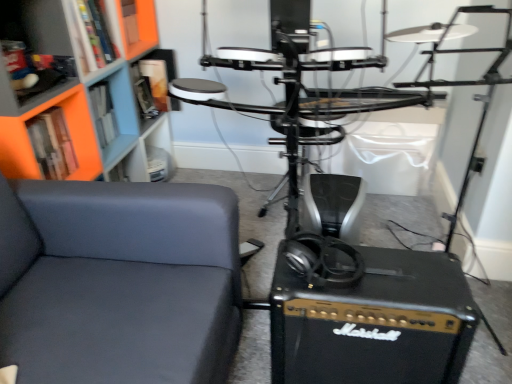
Question: Is orange matte bookshelf at upper left, which is the third shelf in top-to-bottom order, facing towards orange matte bookshelf at upper left, which is the third shelf from bottom to top?

Choices:
 (A) no
 (B) yes

Answer: (A)

Question: Is orange matte bookshelf at upper left, which is the third shelf in top-to-bottom order, outside orange matte bookshelf at upper left, which ranks as the 1th shelf in top-to-bottom order?

Choices:
 (A) no
 (B) yes

Answer: (B)

Question: Can you confirm if orange matte bookshelf at upper left, which appears as the first shelf when ordered from the bottom, is shorter than orange matte bookshelf at upper left, which is the third shelf from bottom to top?

Choices:
 (A) no
 (B) yes

Answer: (B)

Question: Is orange matte bookshelf at upper left, which is the third shelf in top-to-bottom order, closer to the viewer compared to orange matte bookshelf at upper left, which is the third shelf from bottom to top?

Choices:
 (A) no
 (B) yes

Answer: (B)

Question: Does orange matte bookshelf at upper left, which appears as the first shelf when ordered from the bottom, have a smaller size compared to orange matte bookshelf at upper left, which ranks as the 1th shelf in top-to-bottom order?

Choices:
 (A) yes
 (B) no

Answer: (A)

Question: Considering the relative positions of matte gray chair at left and orange matte bookshelf at upper left, which is the third shelf from bottom to top, in the image provided, is matte gray chair at left to the left or to the right of orange matte bookshelf at upper left, which is the third shelf from bottom to top,?

Choices:
 (A) left
 (B) right

Answer: (B)

Question: Is matte gray chair at left wider or thinner than orange matte bookshelf at upper left, which is the third shelf from bottom to top?

Choices:
 (A) wide
 (B) thin

Answer: (A)

Question: From the image's perspective, is matte gray chair at left positioned above or below orange matte bookshelf at upper left, which ranks as the 1th shelf in top-to-bottom order?

Choices:
 (A) below
 (B) above

Answer: (A)

Question: Is matte gray chair at left bigger or smaller than orange matte bookshelf at upper left, which ranks as the 1th shelf in top-to-bottom order?

Choices:
 (A) small
 (B) big

Answer: (B)

Question: From a real-world perspective, relative to matte black shelf at upper left, arranged as the second shelf when ordered from the bottom, is orange matte bookshelf at upper left, which appears as the first shelf when ordered from the bottom, vertically above or below?

Choices:
 (A) below
 (B) above

Answer: (A)

Question: Based on their positions, is orange matte bookshelf at upper left, which is the third shelf in top-to-bottom order, located to the left or right of matte black shelf at upper left, arranged as the second shelf when ordered from the bottom?

Choices:
 (A) right
 (B) left

Answer: (A)

Question: From the image's perspective, relative to matte black shelf at upper left, arranged as the second shelf when ordered from the bottom, is orange matte bookshelf at upper left, which is the third shelf in top-to-bottom order, above or below?

Choices:
 (A) below
 (B) above

Answer: (A)

Question: Is orange matte bookshelf at upper left, which is the third shelf in top-to-bottom order, inside the boundaries of matte black shelf at upper left, the 2th shelf viewed from the top, or outside?

Choices:
 (A) outside
 (B) inside

Answer: (A)

Question: Is point (67, 41) closer or farther from the camera than point (3, 125)?

Choices:
 (A) closer
 (B) farther

Answer: (B)

Question: Is matte black shelf at upper left, the 2th shelf viewed from the top, inside or outside of orange matte bookshelf at upper left, which is the third shelf in top-to-bottom order?

Choices:
 (A) inside
 (B) outside

Answer: (B)